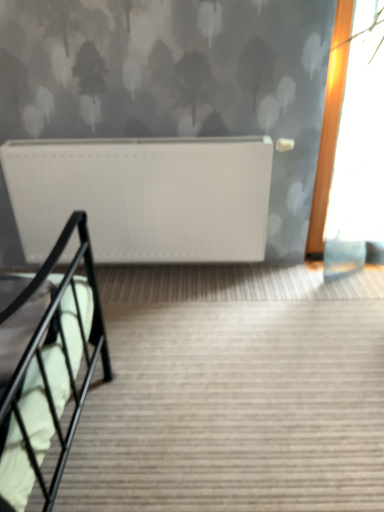
Question: From a real-world perspective, is black metal stairs at lower left positioned above or below white matte radiator at upper center?

Choices:
 (A) below
 (B) above

Answer: (A)

Question: From their relative heights in the image, would you say black metal stairs at lower left is taller or shorter than white matte radiator at upper center?

Choices:
 (A) tall
 (B) short

Answer: (B)

Question: Which is correct: black metal stairs at lower left is inside white matte radiator at upper center, or outside of it?

Choices:
 (A) outside
 (B) inside

Answer: (A)

Question: Does point (79, 183) appear closer or farther from the camera than point (372, 347)?

Choices:
 (A) farther
 (B) closer

Answer: (A)

Question: From a real-world perspective, is white matte radiator at upper center above or below black metal stairs at lower left?

Choices:
 (A) above
 (B) below

Answer: (A)

Question: Would you say white matte radiator at upper center is to the left or to the right of black metal stairs at lower left in the picture?

Choices:
 (A) right
 (B) left

Answer: (B)

Question: Is white matte radiator at upper center taller or shorter than black metal stairs at lower left?

Choices:
 (A) short
 (B) tall

Answer: (B)